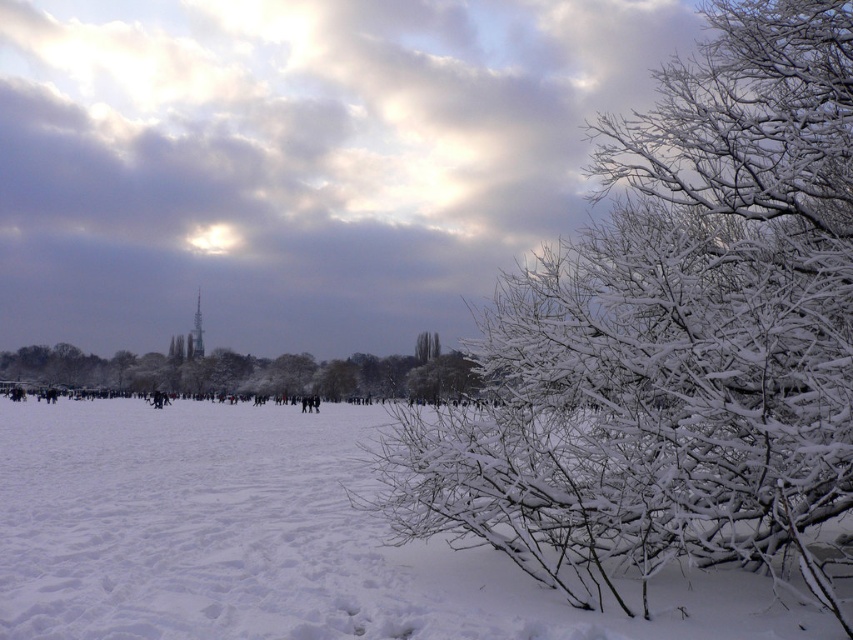
Between white frosty branches at lower right and white frosty branches at center, which one appears on the left side from the viewer's perspective?

white frosty branches at lower right is more to the left.

Is white frosty branches at lower right taller than white frosty branches at center?

No, white frosty branches at lower right is not taller than white frosty branches at center.

This screenshot has width=853, height=640. Identify the location of white frosty branches at lower right. (279, 541).

Image resolution: width=853 pixels, height=640 pixels. Find the location of `white frosty branches at center right`. white frosty branches at center right is located at coordinates (672, 337).

Can you confirm if white frosty branches at center right is thinner than white frosty branches at lower right?

Yes.

Who is more distant from viewer, (846, 81) or (65, 531)?

Point (65, 531)

Identify the location of white frosty branches at center right. The image size is (853, 640). (672, 337).